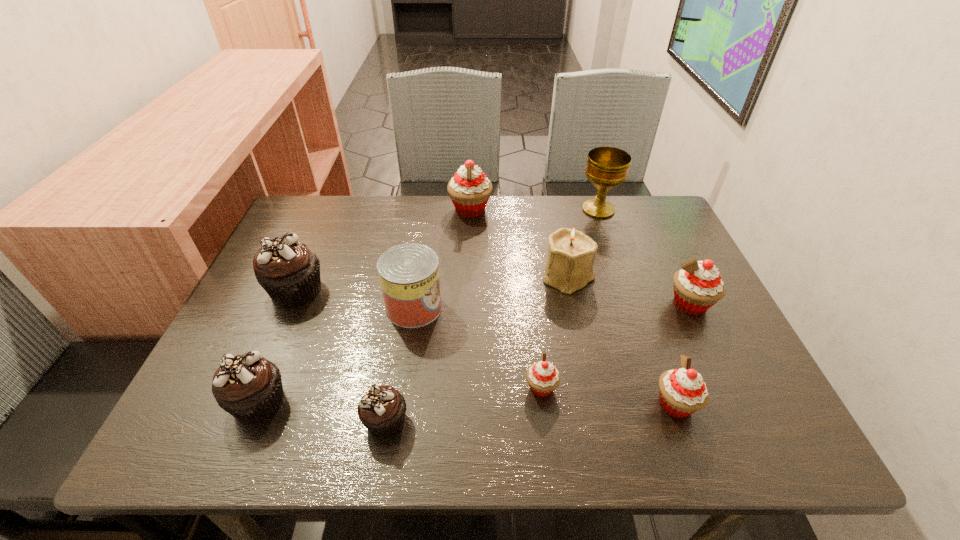
Locate an element on the screen. object that is at the far right corner is located at coordinates (607, 167).

Find the location of a particular element. Image resolution: width=960 pixels, height=540 pixels. object that is at the near right corner is located at coordinates (682, 391).

Locate an element on the screen. The image size is (960, 540). free spot at the far edge of the desktop is located at coordinates pos(436,232).

The image size is (960, 540). I want to click on vacant space at the near edge of the desktop, so click(x=524, y=443).

You are a GUI agent. You are given a task and a screenshot of the screen. Output one action in this format:
    pyautogui.click(x=<x>, y=<y>)
    Task: Click on the vacant area at the left edge of the desktop
    
    Given the screenshot: What is the action you would take?
    pyautogui.click(x=302, y=314)

Where is `free location at the right edge`? The width and height of the screenshot is (960, 540). free location at the right edge is located at coordinates (653, 249).

You are a GUI agent. You are given a task and a screenshot of the screen. Output one action in this format:
    pyautogui.click(x=<x>, y=<y>)
    Task: Click on the vacant space at the far left corner of the desktop
    Image resolution: width=960 pixels, height=540 pixels.
    Given the screenshot: What is the action you would take?
    pyautogui.click(x=329, y=237)

In the image, there is a desktop. Where is `free region at the far right corner`? Image resolution: width=960 pixels, height=540 pixels. free region at the far right corner is located at coordinates (674, 233).

What are the coordinates of `free spot between the beige candle_holder and the third cupcake from right to left` in the screenshot? It's located at (555, 332).

Where is `free space between the fourth cupcake from right to left and the third cupcake from right to left`? The width and height of the screenshot is (960, 540). free space between the fourth cupcake from right to left and the third cupcake from right to left is located at coordinates (506, 299).